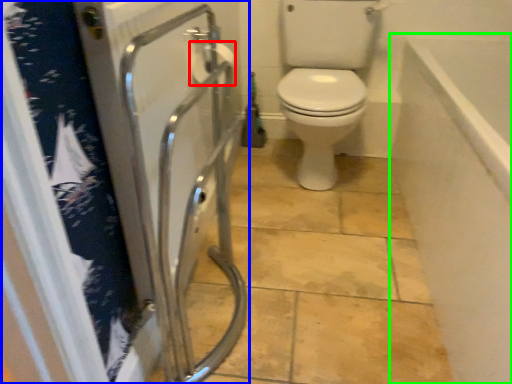
Question: Considering the real-world distances, which object is farthest from toilet paper (highlighted by a red box)? screen door (highlighted by a blue box) or bath (highlighted by a green box)?

Choices:
 (A) screen door
 (B) bath

Answer: (B)